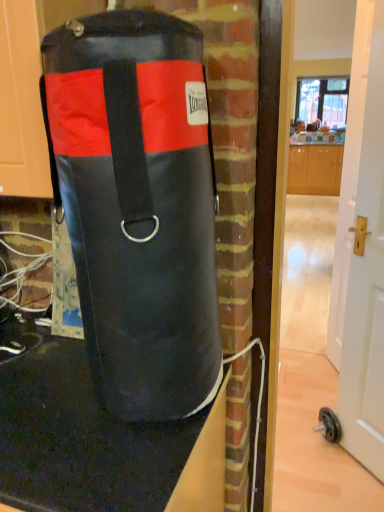
The image size is (384, 512). What are the coordinates of `free space above black rubber mat at lower left (from a real-world perspective)` in the screenshot? It's located at (57, 400).